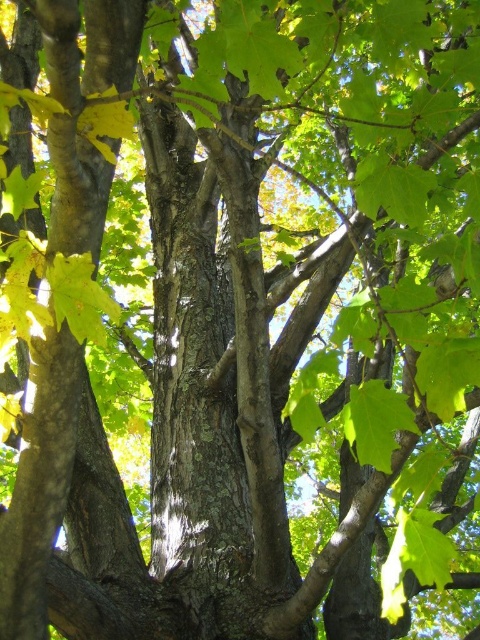
Which is behind, point (398, 516) or point (420, 218)?

The point (398, 516) is more distant.

What are the coordinates of `green matte leaf at lower right` in the screenshot? It's located at (414, 557).

Does green matte maple leaf at upper left have a lesser width compared to yellow matte leaf at upper left?

Incorrect, green matte maple leaf at upper left's width is not less than yellow matte leaf at upper left's.

Which is more to the right, green matte maple leaf at upper left or yellow matte leaf at upper left?

From the viewer's perspective, yellow matte leaf at upper left appears more on the right side.

I want to click on green matte maple leaf at upper left, so click(79, 298).

Can you confirm if green matte leaf at lower right is smaller than green matte maple leaf at upper left?

Actually, green matte leaf at lower right might be larger than green matte maple leaf at upper left.

Which is behind, point (398, 579) or point (104, 333)?

The point (398, 579) is more distant.

Identify the location of green matte leaf at lower right. This screenshot has height=640, width=480. (414, 557).